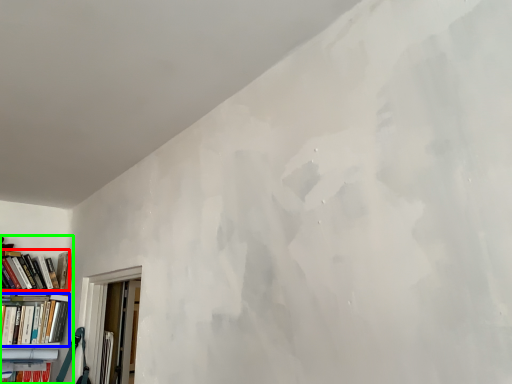
Question: Estimate the real-world distances between objects in this image. Which object is closer to book (highlighted by a red box), book (highlighted by a blue box) or bookcase (highlighted by a green box)?

Choices:
 (A) book
 (B) bookcase

Answer: (B)